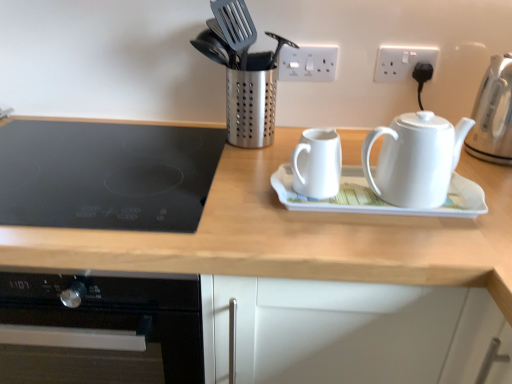
Find the location of a particular element. The height and width of the screenshot is (384, 512). vacant space in front of white ceramic saucer at center is located at coordinates (393, 239).